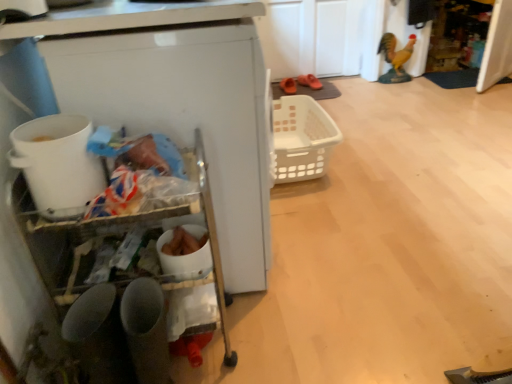
I want to click on free spot below shiny gold statue at upper right (from a real-world perspective), so click(x=392, y=83).